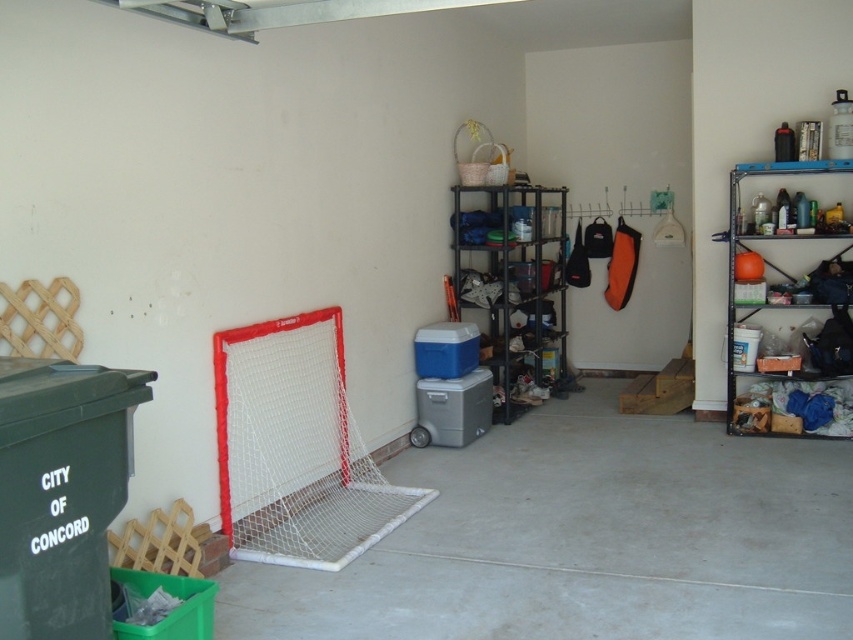
You are a delivery person who needs to place a package between the white mesh net at left and the orange matte sports ball at right. The package requires 3 meters of space to fit. Can you fit the package between them?

The white mesh net at left and orange matte sports ball at right are 2.83 meters apart from each other, so the package requiring 3 meters of space cannot fit between them.

You are organizing items in the garage and need to place the green plastic cooler at lower left closer to the orange matte sports ball at right. How far apart are they currently?

The green plastic cooler at lower left is 4.31 meters away from the orange matte sports ball at right. To place them closer, you need to reduce this distance.

You are standing in the garage and want to locate two specific points marked in the image. Which of the two points, point (65, 433) or point (741, 387), is closer to your current position?

Point (65, 433) is closer to the camera than point (741, 387), so it is closer to your current position.